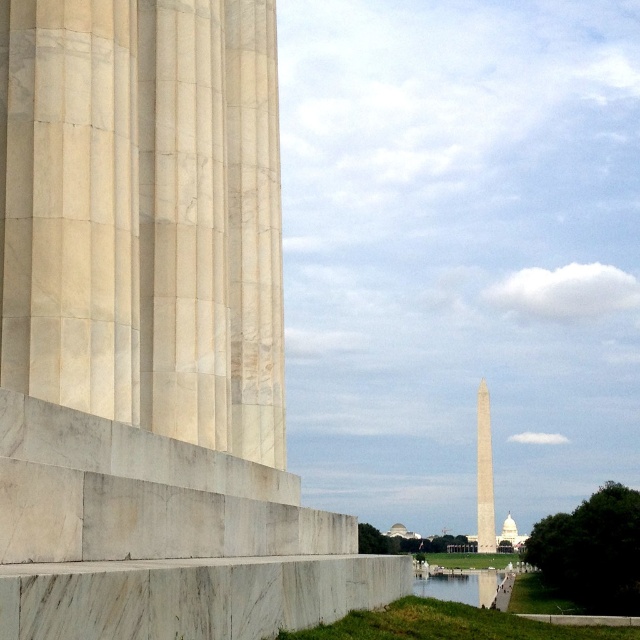
Question: Can you confirm if white marble column at left is bigger than white marble obelisk at center?

Choices:
 (A) yes
 (B) no

Answer: (B)

Question: Which point is closer to the camera?

Choices:
 (A) white marble obelisk at center
 (B) white marble column at left

Answer: (B)

Question: Which object appears closest to the camera in this image?

Choices:
 (A) white marble column at left
 (B) white marble obelisk at center

Answer: (A)

Question: From the image, what is the correct spatial relationship of white marble column at left in relation to white marble obelisk at center?

Choices:
 (A) below
 (B) above

Answer: (B)

Question: Is white marble column at left positioned before white marble obelisk at center?

Choices:
 (A) no
 (B) yes

Answer: (B)